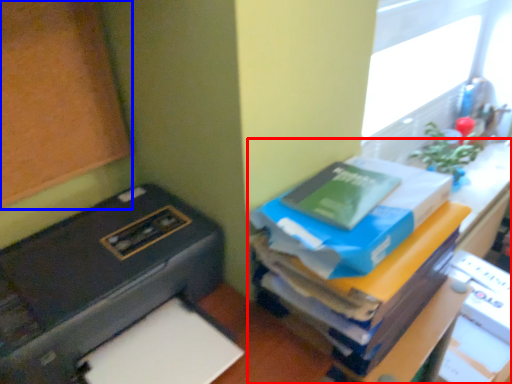
Question: Which object is further to the camera taking this photo, furniture (highlighted by a red box) or bulletin board (highlighted by a blue box)?

Choices:
 (A) furniture
 (B) bulletin board

Answer: (A)